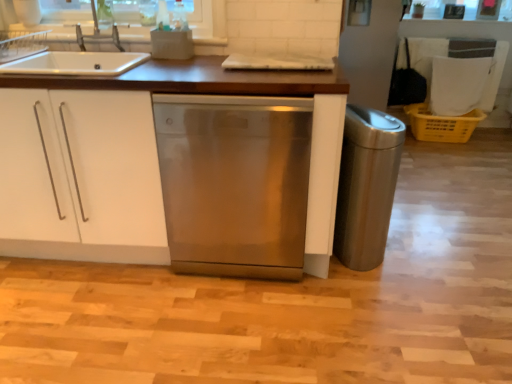
This screenshot has height=384, width=512. I want to click on free location in front of stainless steel trash can at right, so click(376, 296).